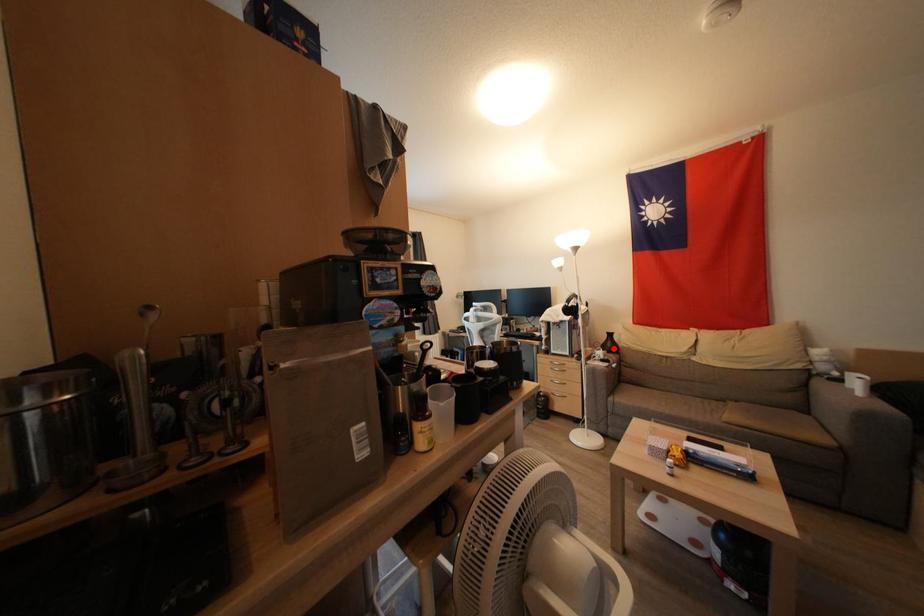
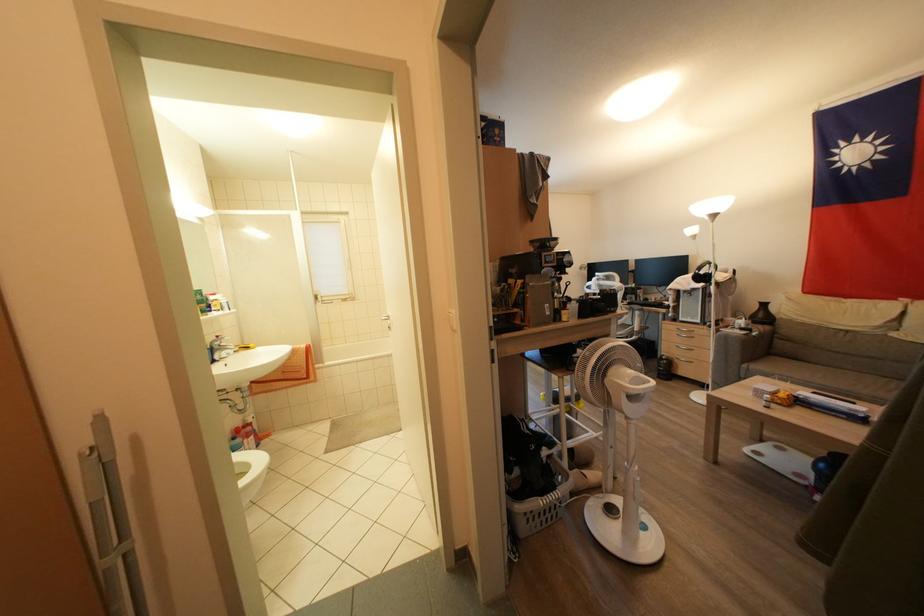
In the second image, find the point that corresponds to the highlighted location in the first image.

(766, 320)